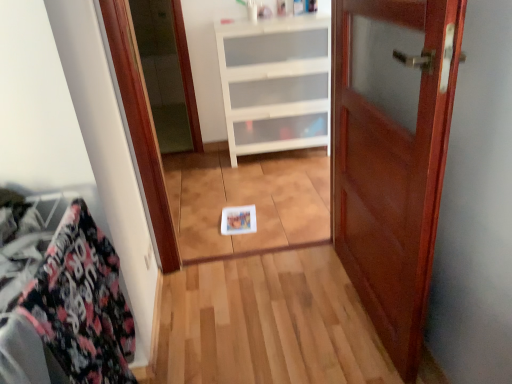
Question: Is floral fabric at left positioned with its back to white plastic drawer at center?

Choices:
 (A) no
 (B) yes

Answer: (A)

Question: Does floral fabric at left appear on the left side of white plastic drawer at center?

Choices:
 (A) yes
 (B) no

Answer: (A)

Question: Does floral fabric at left have a larger size compared to white plastic drawer at center?

Choices:
 (A) yes
 (B) no

Answer: (B)

Question: Is floral fabric at left outside white plastic drawer at center?

Choices:
 (A) yes
 (B) no

Answer: (A)

Question: Considering the relative positions of floral fabric at left and white plastic drawer at center in the image provided, is floral fabric at left to the right of white plastic drawer at center from the viewer's perspective?

Choices:
 (A) no
 (B) yes

Answer: (A)

Question: Choose the correct answer: Is mahogany wood door at center inside floral fabric at left or outside it?

Choices:
 (A) outside
 (B) inside

Answer: (A)

Question: In the image, is mahogany wood door at center positioned in front of or behind floral fabric at left?

Choices:
 (A) behind
 (B) front

Answer: (A)

Question: In terms of width, does mahogany wood door at center look wider or thinner when compared to floral fabric at left?

Choices:
 (A) thin
 (B) wide

Answer: (A)

Question: From a real-world perspective, relative to floral fabric at left, is mahogany wood door at center vertically above or below?

Choices:
 (A) above
 (B) below

Answer: (A)

Question: From the image's perspective, relative to mahogany wood door at center, is white plastic drawer at center above or below?

Choices:
 (A) below
 (B) above

Answer: (B)

Question: Considering the positions of white plastic drawer at center and mahogany wood door at center in the image, is white plastic drawer at center taller or shorter than mahogany wood door at center?

Choices:
 (A) short
 (B) tall

Answer: (A)

Question: Based on their sizes in the image, would you say white plastic drawer at center is bigger or smaller than mahogany wood door at center?

Choices:
 (A) big
 (B) small

Answer: (A)

Question: Is white plastic drawer at center situated inside mahogany wood door at center or outside?

Choices:
 (A) outside
 (B) inside

Answer: (A)

Question: From the image's perspective, relative to floral fabric at left, is white plastic drawer at center above or below?

Choices:
 (A) above
 (B) below

Answer: (A)

Question: In the image, is white plastic drawer at center on the left side or the right side of floral fabric at left?

Choices:
 (A) right
 (B) left

Answer: (A)